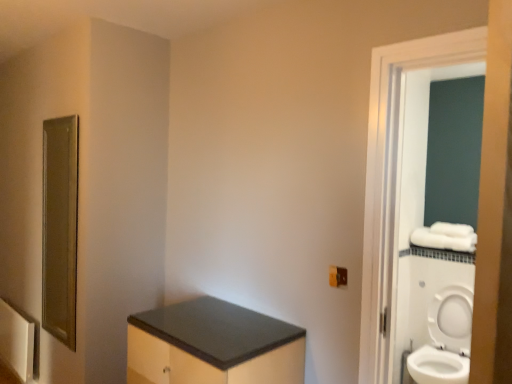
Question: Considering the relative positions of white fabric towel bar at right and matte black cabinet at lower center in the image provided, is white fabric towel bar at right to the right of matte black cabinet at lower center from the viewer's perspective?

Choices:
 (A) no
 (B) yes

Answer: (B)

Question: Is white fabric towel bar at right taller than matte black cabinet at lower center?

Choices:
 (A) no
 (B) yes

Answer: (A)

Question: Is white fabric towel bar at right positioned far away from matte black cabinet at lower center?

Choices:
 (A) yes
 (B) no

Answer: (A)

Question: Can you confirm if white fabric towel bar at right is wider than matte black cabinet at lower center?

Choices:
 (A) yes
 (B) no

Answer: (B)

Question: From the image's perspective, does white fabric towel bar at right appear lower than matte black cabinet at lower center?

Choices:
 (A) no
 (B) yes

Answer: (A)

Question: Can you confirm if white fabric towel bar at right is smaller than matte black cabinet at lower center?

Choices:
 (A) no
 (B) yes

Answer: (B)

Question: Does gold textured mirror at left appear on the right side of white glossy screen door at right?

Choices:
 (A) no
 (B) yes

Answer: (A)

Question: Can you confirm if gold textured mirror at left is positioned to the left of white glossy screen door at right?

Choices:
 (A) no
 (B) yes

Answer: (B)

Question: From a real-world perspective, is gold textured mirror at left physically below white glossy screen door at right?

Choices:
 (A) yes
 (B) no

Answer: (A)

Question: Is gold textured mirror at left positioned behind white glossy screen door at right?

Choices:
 (A) no
 (B) yes

Answer: (B)

Question: Is gold textured mirror at left not within white glossy screen door at right?

Choices:
 (A) no
 (B) yes

Answer: (B)

Question: From the image's perspective, would you say gold textured mirror at left is shown under white glossy screen door at right?

Choices:
 (A) no
 (B) yes

Answer: (B)

Question: Is matte brown electric outlet at lower right far away from matte black cabinet at lower center?

Choices:
 (A) no
 (B) yes

Answer: (A)